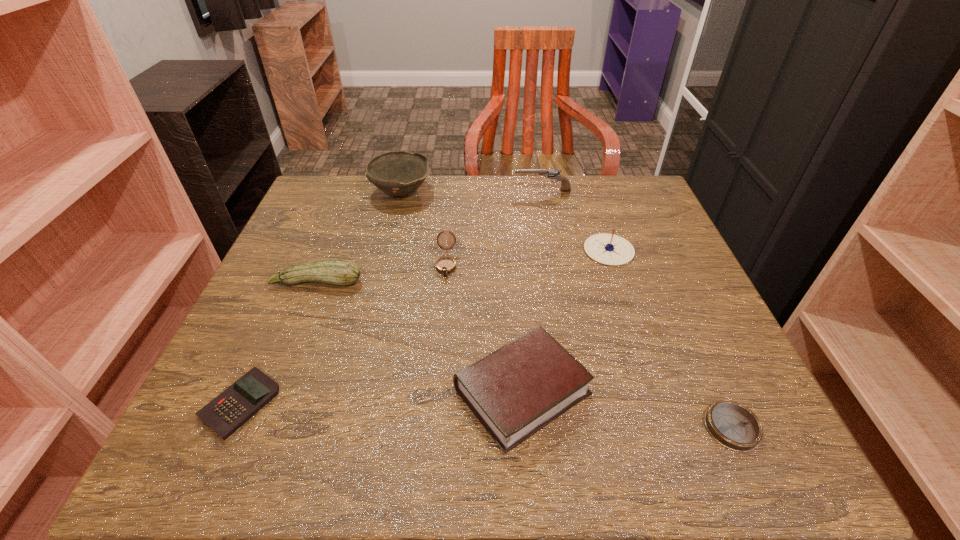
You are a GUI agent. You are given a task and a screenshot of the screen. Output one action in this format:
    pyautogui.click(x=<x>, y=<y>)
    Task: Click on the free area in between the fourth object from left to right and the gun
    The height and width of the screenshot is (540, 960).
    Given the screenshot: What is the action you would take?
    pyautogui.click(x=494, y=227)

Identify the location of free space that is in between the fifth object from right to left and the zucchini. (382, 273).

You are a GUI agent. You are given a task and a screenshot of the screen. Output one action in this format:
    pyautogui.click(x=<x>, y=<y>)
    Task: Click on the empty location between the bowl and the calculator
    
    Given the screenshot: What is the action you would take?
    pyautogui.click(x=321, y=298)

Identify the location of vacant space that's between the Bible and the gun. The image size is (960, 540). (533, 291).

Where is `vacant region between the fifth object from right to left and the nearest compass`? vacant region between the fifth object from right to left and the nearest compass is located at coordinates (589, 346).

Where is `blank region between the gun and the calculator`? This screenshot has height=540, width=960. blank region between the gun and the calculator is located at coordinates (392, 297).

I want to click on free space between the gun and the calculator, so click(392, 297).

Select which object is the second closest to the gun. Please provide its 2D coordinates. Your answer should be formatted as a tuple, i.e. [(x, y)], where the tuple contains the x and y coordinates of a point satisfying the conditions above.

[(397, 173)]

This screenshot has height=540, width=960. Find the location of `object that is the seventh closest to the fourth object from left to right`. object that is the seventh closest to the fourth object from left to right is located at coordinates (733, 425).

Select which compass appears as the third closest to the gun. Please provide its 2D coordinates. Your answer should be formatted as a tuple, i.e. [(x, y)], where the tuple contains the x and y coordinates of a point satisfying the conditions above.

[(733, 425)]